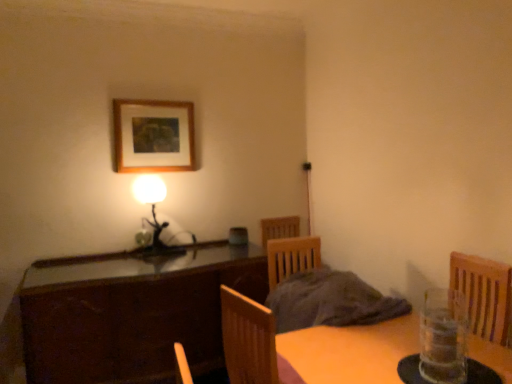
At what (x,y) coordinates should I click in order to perform the action: click on free space to the left of clear glass vase at lower right. Please return your answer as a coordinate pair (x, y). The height and width of the screenshot is (384, 512). Looking at the image, I should click on (409, 370).